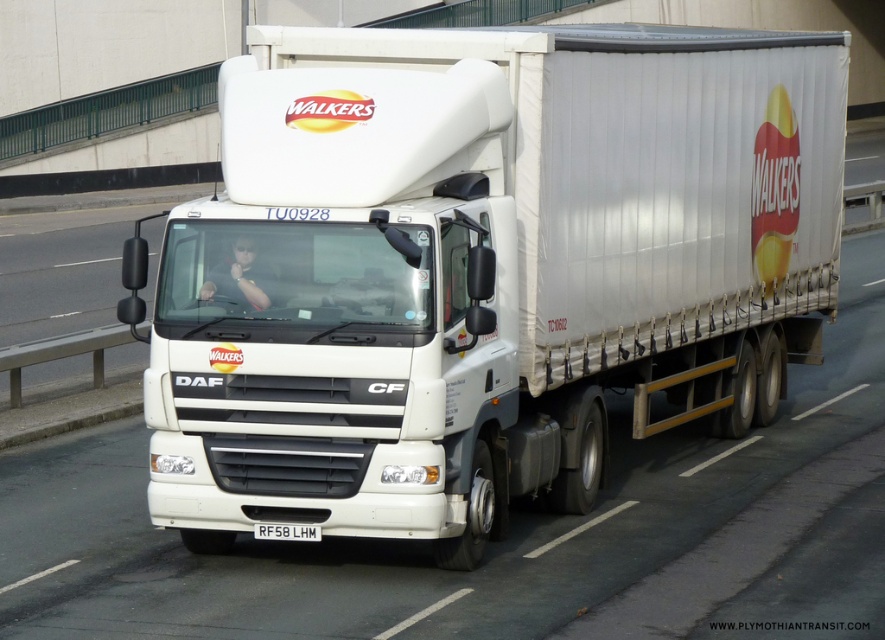
Question: Is white matte truck at center below matte black shirt at center?

Choices:
 (A) no
 (B) yes

Answer: (A)

Question: Does white matte truck at center appear on the right side of white plastic license plate at center?

Choices:
 (A) no
 (B) yes

Answer: (B)

Question: Which object is positioned farthest from the matte black shirt at center?

Choices:
 (A) white matte truck at center
 (B) white plastic license plate at center

Answer: (A)

Question: Which of the following is the farthest from the observer?

Choices:
 (A) matte black shirt at center
 (B) white plastic license plate at center
 (C) white matte truck at center

Answer: (B)

Question: Which point appears farthest from the camera in this image?

Choices:
 (A) (245, 307)
 (B) (260, 531)
 (C) (345, 524)

Answer: (B)

Question: Is white matte truck at center behind matte black shirt at center?

Choices:
 (A) yes
 (B) no

Answer: (B)